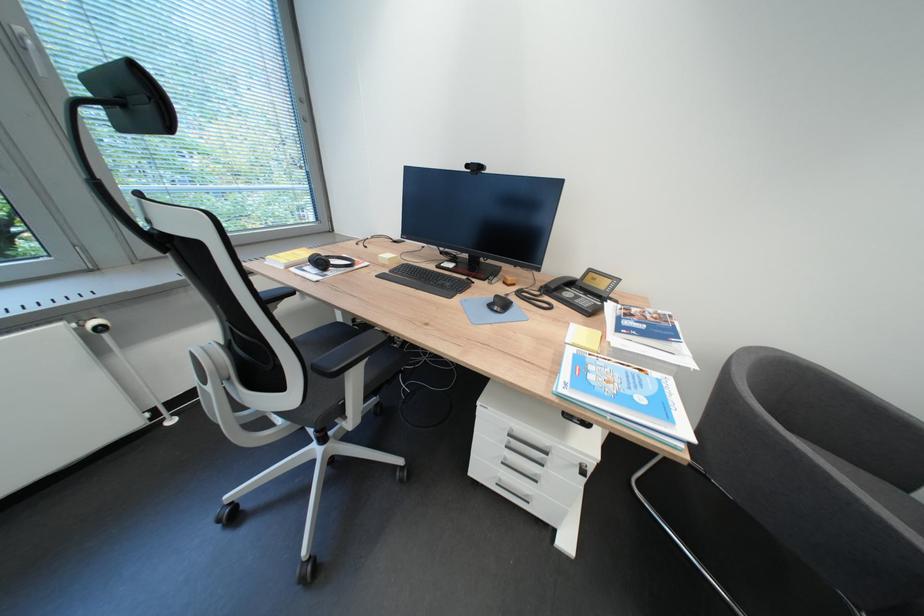
At what (x,y) coordinates should I click in order to perform the action: click on black chair sitting surface. Please return your answer as a coordinate pair (x, y). The height and width of the screenshot is (616, 924). Looking at the image, I should click on (348, 353).